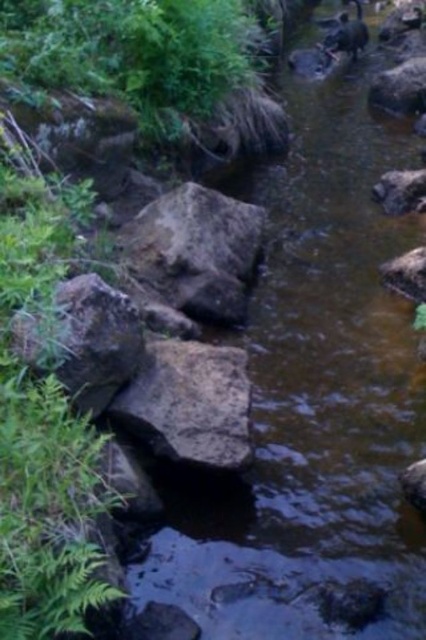
Question: Is gray rough rock at lower left to the left of brown furry animal at upper center from the viewer's perspective?

Choices:
 (A) yes
 (B) no

Answer: (A)

Question: In this image, where is brown rough rock at center located relative to gray rough rock at lower left?

Choices:
 (A) above
 (B) below

Answer: (B)

Question: Which object is the farthest from the rough stone boulder at center?

Choices:
 (A) brown furry animal at upper center
 (B) gray rough rock at lower left
 (C) brown rough rock at center

Answer: (A)

Question: Can you confirm if brown rough rock at center is positioned below brown furry animal at upper center?

Choices:
 (A) yes
 (B) no

Answer: (A)

Question: Among these objects, which one is nearest to the camera?

Choices:
 (A) rough stone boulder at center
 (B) brown furry animal at upper center
 (C) brown rough rock at center
 (D) gray rough rock at lower left

Answer: (D)

Question: Which object is farther from the camera taking this photo?

Choices:
 (A) brown rough rock at center
 (B) rough stone boulder at center
 (C) gray rough rock at lower left

Answer: (B)